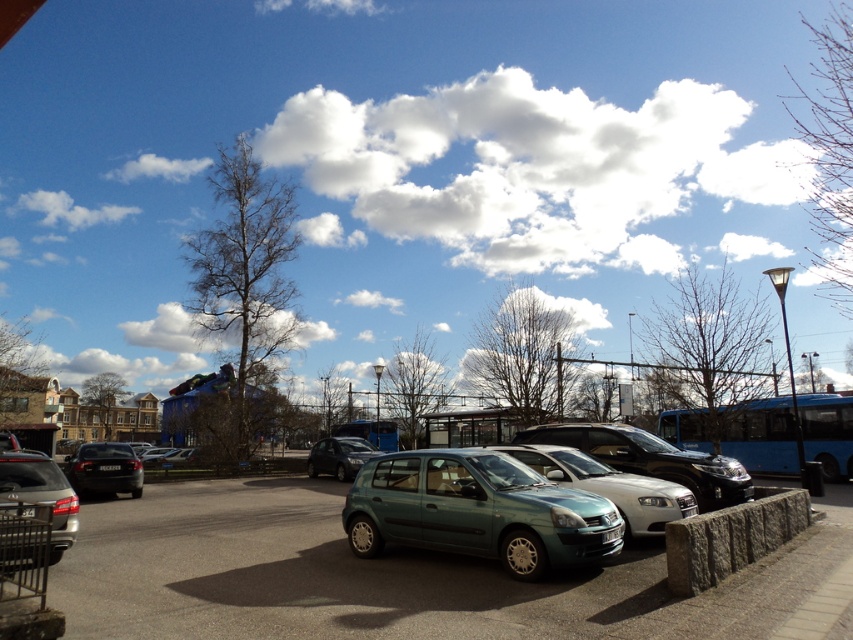
You are standing at the center of the parking lot and want to find the blue metallic bus at right. According to the 2D coordinates, where should you look relative to your position?

The blue metallic bus at right is located at coordinates 0.681 on the x axis and 0.893 on the y axis, so you should look to the right and slightly forward from your current position at the center.

You are standing in the parking lot and want to take a photo of the matte black car at left and the white plastic license plate at center. Which object should you focus on first to ensure both are in the frame?

You should focus on the matte black car at left first because it is closer to the viewer than the white plastic license plate at center, so adjusting the camera to capture it ensures the license plate will also be in the frame.

You are standing at point point (x=479, y=512) in the parking lot. What object are you standing on?

You are standing on the metallic green hatchback at center.